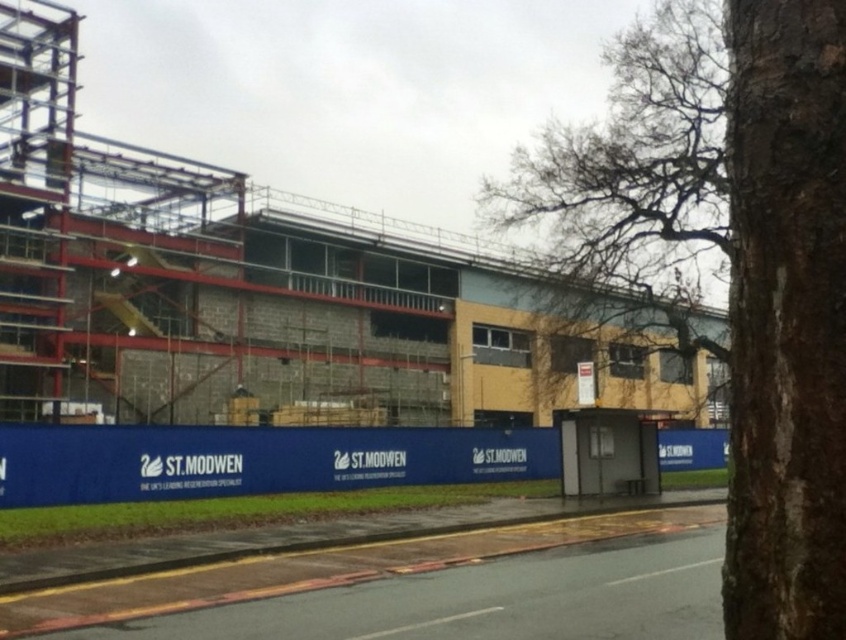
Question: Does brown rough bark tree at right appear on the left side of bare branches at upper right?

Choices:
 (A) yes
 (B) no

Answer: (A)

Question: Does brown rough bark tree at right have a lesser width compared to bare branches at upper right?

Choices:
 (A) yes
 (B) no

Answer: (A)

Question: Is brown rough bark tree at center right in front of bare branches at upper right?

Choices:
 (A) yes
 (B) no

Answer: (A)

Question: Which point is closer to the camera?

Choices:
 (A) brown rough bark tree at center right
 (B) brown rough bark tree at right
 (C) bare branches at upper right

Answer: (B)

Question: Which is farther from the brown rough bark tree at center right?

Choices:
 (A) bare branches at upper right
 (B) brown rough bark tree at right

Answer: (B)

Question: Which of these objects is positioned farthest from the brown rough bark tree at right?

Choices:
 (A) bare branches at upper right
 (B) brown rough bark tree at center right

Answer: (A)